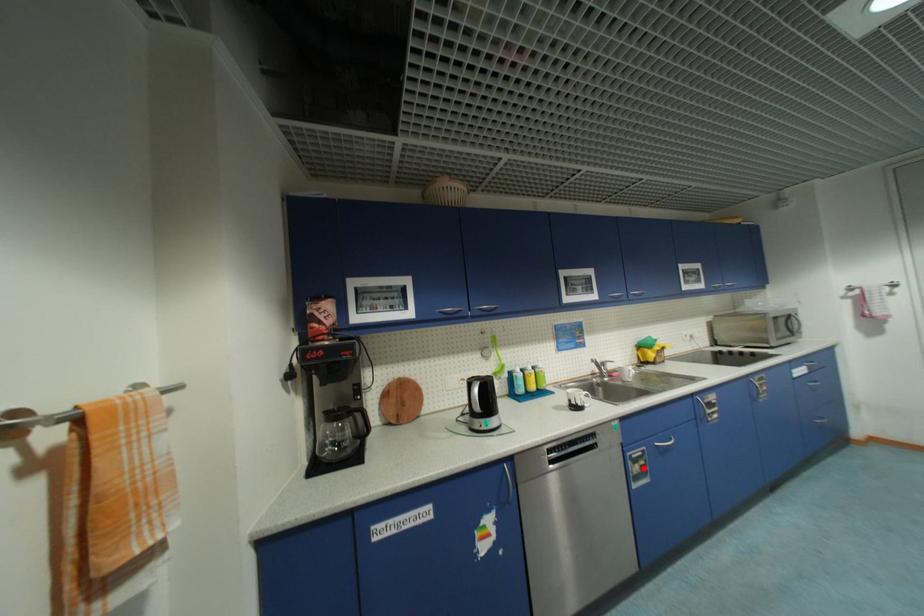
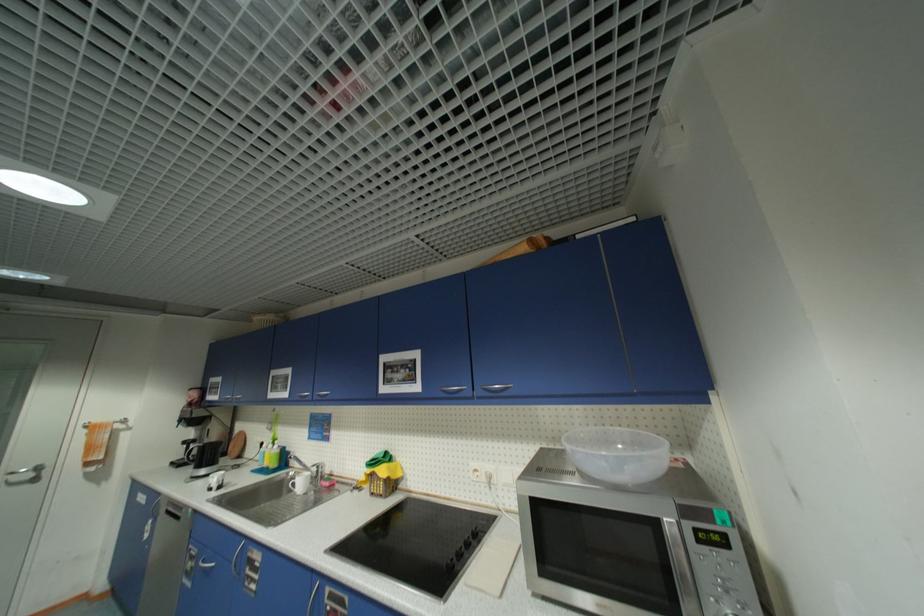
In the second image, find the point that corresponds to the highlighted location in the first image.

(196, 565)